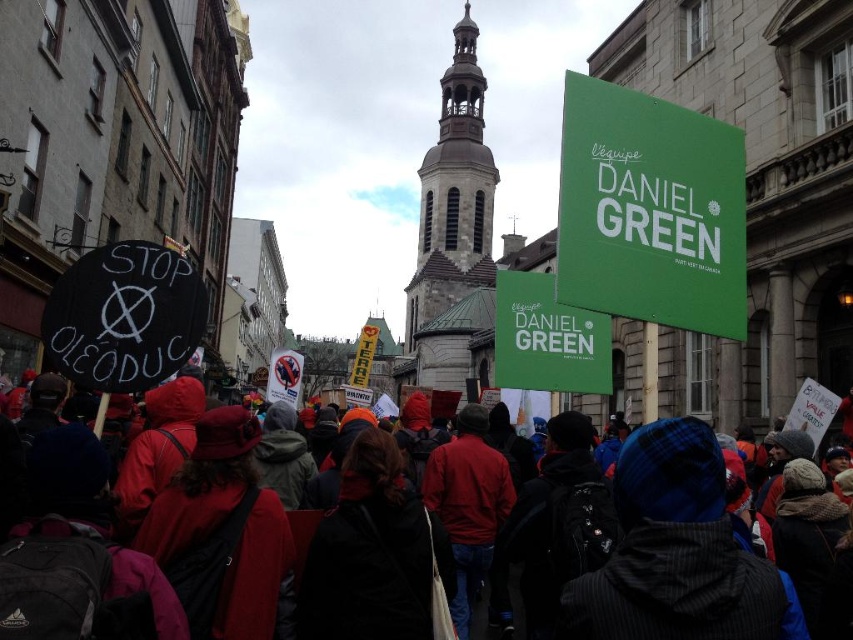
You are a photographer standing in the middle of the protest crowd. You want to take a photo that includes both the green matte sign at upper center and the green matte sign at upper right. Which sign should you focus on first to ensure both are in frame?

The green matte sign at upper center is closer to you than the green matte sign at upper right. To include both in the frame, focus on the green matte sign at upper center first, then adjust your angle to include the green matte sign at upper right which is further away.